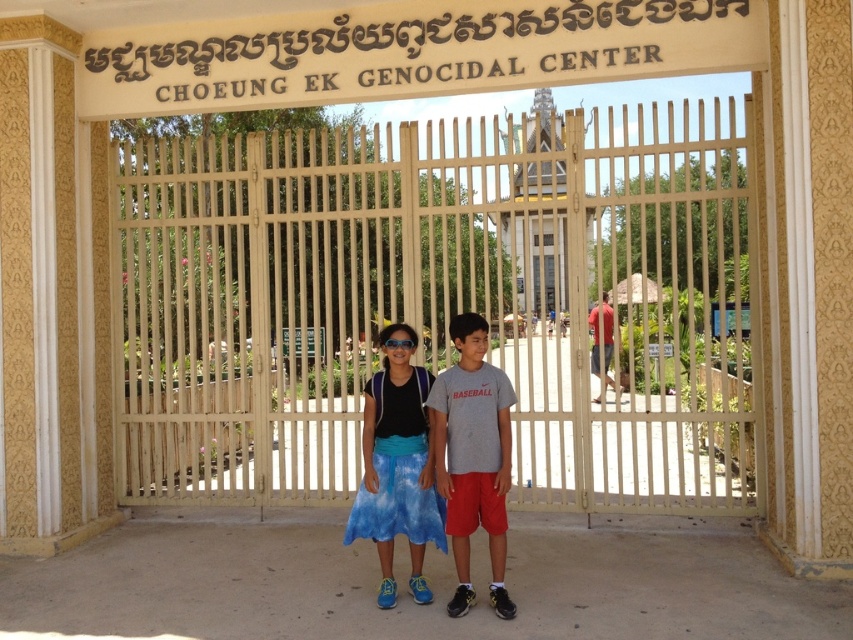
Question: Does beige metal gate at center appear on the right side of blue tie-dye skirt at center?

Choices:
 (A) yes
 (B) no

Answer: (B)

Question: Which point is farther to the camera?

Choices:
 (A) transparent plastic goggles at center
 (B) gray cotton t-shirt at center
 (C) beige metal gate at center

Answer: (C)

Question: Considering the relative positions of blue tie-dye skirt at center and transparent plastic goggles at center in the image provided, where is blue tie-dye skirt at center located with respect to transparent plastic goggles at center?

Choices:
 (A) right
 (B) left

Answer: (B)

Question: Among these objects, which one is farthest from the camera?

Choices:
 (A) gray cotton t-shirt at center
 (B) beige metal gate at center
 (C) transparent plastic goggles at center

Answer: (B)

Question: Does beige metal gate at center have a larger size compared to transparent plastic goggles at center?

Choices:
 (A) yes
 (B) no

Answer: (A)

Question: Which point is farther to the camera?

Choices:
 (A) (386, 340)
 (B) (389, 529)
 (C) (538, 435)
 (D) (480, 458)

Answer: (C)